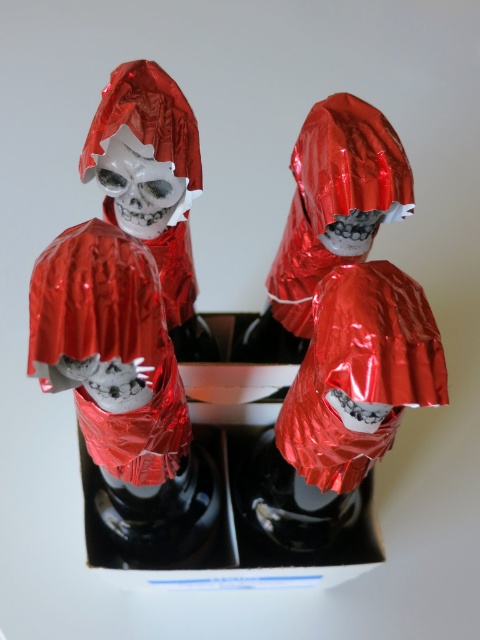
Question: Which of the following is the closest to the observer?

Choices:
 (A) shiny metallic skull at center
 (B) metallic black box at center

Answer: (A)

Question: Does metallic black box at center have a lesser width compared to shiny metallic skull at center?

Choices:
 (A) no
 (B) yes

Answer: (A)

Question: Is metallic black box at center wider than shiny metallic skull at center?

Choices:
 (A) yes
 (B) no

Answer: (A)

Question: Is metallic black box at center thinner than shiny metallic skull at center?

Choices:
 (A) yes
 (B) no

Answer: (B)